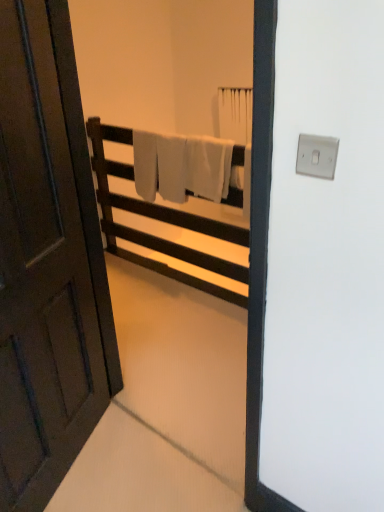
At what (x,y) coordinates should I click in order to perform the action: click on white matte towel rack at center. Please return your answer as a coordinate pair (x, y). Looking at the image, I should click on (161, 221).

Describe the element at coordinates (181, 166) in the screenshot. I see `white soft towel at center` at that location.

I want to click on white matte towel rack at center, so click(x=161, y=221).

From the image's perspective, does dark wood door at left appear lower than white matte towel rack at center?

Yes.

Which object is wider, dark wood door at left or white matte towel rack at center?

white matte towel rack at center is wider.

Which point is more distant from viewer, (20,73) or (135,261)?

The point (135,261) is behind.

How distant is dark wood door at left from white matte towel rack at center?

dark wood door at left and white matte towel rack at center are 4.23 feet apart from each other.

Between white soft towel at center and dark wood door at left, which one has smaller width?

white soft towel at center.

From a real-world perspective, between white soft towel at center and dark wood door at left, who is vertically higher?

dark wood door at left is physically above.

Which point is more forward, (x=168, y=176) or (x=52, y=91)?

The point (x=52, y=91) is more forward.

Could you tell me if white soft towel at center is facing dark wood door at left?

Yes, white soft towel at center is aimed at dark wood door at left.

Considering the sizes of objects dark wood door at left and white soft towel at center in the image provided, who is taller, dark wood door at left or white soft towel at center?

dark wood door at left.

From the picture: Can we say dark wood door at left lies outside white soft towel at center?

Yes.

Which object is further away from the camera taking this photo, dark wood door at left or white soft towel at center?

white soft towel at center is more distant.

Does dark wood door at left have a smaller size compared to white soft towel at center?

No, dark wood door at left is not smaller than white soft towel at center.

From the image's perspective, is white matte towel rack at center beneath dark wood door at left?

Incorrect, from the image's perspective, white matte towel rack at center is higher than dark wood door at left.

Is white matte towel rack at center shorter than dark wood door at left?

Correct, white matte towel rack at center is not as tall as dark wood door at left.

Image resolution: width=384 pixels, height=512 pixels. What are the coordinates of `door above the white matte towel rack at center (from a real-world perspective)` in the screenshot? It's located at (47, 261).

How different are the orientations of white matte towel rack at center and white soft towel at center in degrees?

They differ by 1.09 degrees in their facing directions.

Is white matte towel rack at center beside white soft towel at center?

No, white matte towel rack at center is not with white soft towel at center.

Looking at their sizes, would you say white matte towel rack at center is wider or thinner than white soft towel at center?

Considering their sizes, white matte towel rack at center looks broader than white soft towel at center.

Is white matte towel rack at center taller than white soft towel at center?

Yes.

Does white soft towel at center appear on the left side of white matte towel rack at center?

Incorrect, white soft towel at center is not on the left side of white matte towel rack at center.

From a real-world perspective, between white soft towel at center and white matte towel rack at center, who is vertically lower?

In real-world perspective, white matte towel rack at center is lower.

Considering the sizes of white soft towel at center and white matte towel rack at center in the image, is white soft towel at center taller or shorter than white matte towel rack at center?

Clearly, white soft towel at center is shorter compared to white matte towel rack at center.

In order to click on furniture that is above the dark wood door at left (from the image's perspective) in this screenshot , I will do `click(161, 221)`.

This screenshot has width=384, height=512. There is a white soft towel at center. In order to click on door above it (from a real-world perspective) in this screenshot , I will do `click(47, 261)`.

From the picture: Which object lies further to the anchor point white soft towel at center, dark wood door at left or white matte towel rack at center?

dark wood door at left is further to white soft towel at center.

Which object lies nearer to the anchor point white soft towel at center, white matte towel rack at center or dark wood door at left?

white matte towel rack at center.

From the image, which object appears to be farther from dark wood door at left, white soft towel at center or white matte towel rack at center?

white matte towel rack at center is positioned further to the anchor dark wood door at left.

Looking at the image, which one is located further to dark wood door at left, white matte towel rack at center or white soft towel at center?

white matte towel rack at center is positioned further to the anchor dark wood door at left.

From the image, which object appears to be nearer to white matte towel rack at center, dark wood door at left or white soft towel at center?

white soft towel at center.

Looking at this image, based on their spatial positions, is white soft towel at center or dark wood door at left further from white matte towel rack at center?

The object further to white matte towel rack at center is dark wood door at left.

Image resolution: width=384 pixels, height=512 pixels. I want to click on furniture between dark wood door at left and white soft towel at center in the front-back direction, so (x=161, y=221).